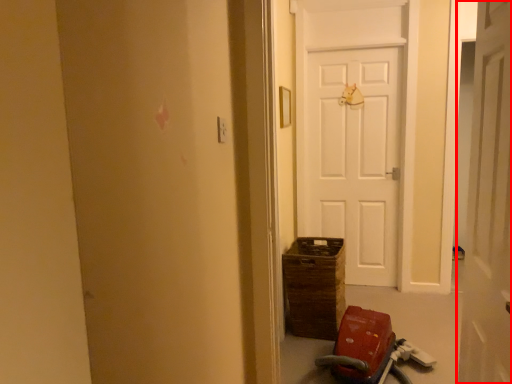
Question: From the image's perspective, considering the relative positions of door (annotated by the red box) and baby carriage in the image provided, where is door (annotated by the red box) located with respect to the staircase?

Choices:
 (A) above
 (B) below

Answer: (A)